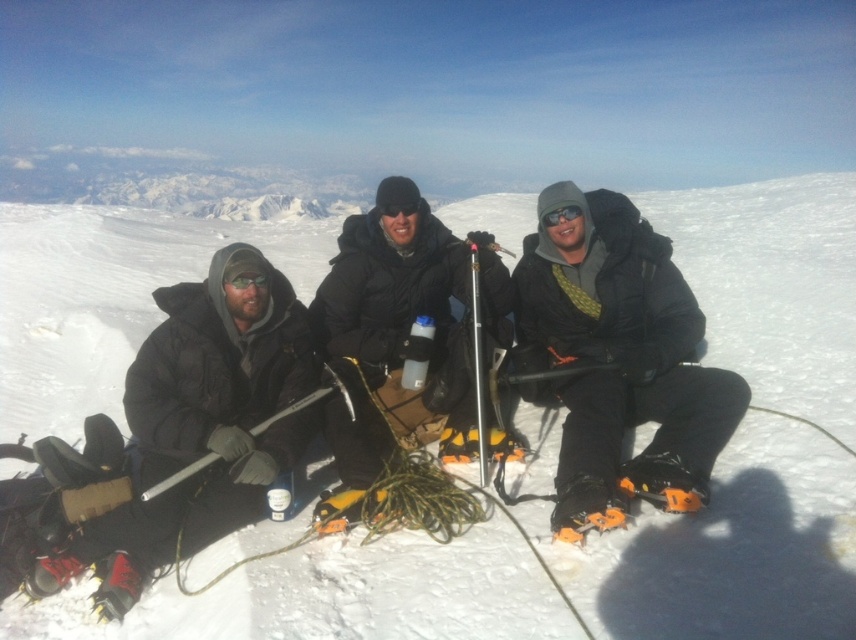
Question: Does white powder snow at center appear on the right side of matte black jacket at center?

Choices:
 (A) no
 (B) yes

Answer: (A)

Question: Is white powder snow at center positioned before matte black jacket at center?

Choices:
 (A) no
 (B) yes

Answer: (B)

Question: Does white powder snow at center appear on the right side of matte black jacket at center?

Choices:
 (A) no
 (B) yes

Answer: (A)

Question: Which point is farther to the camera?

Choices:
 (A) (705, 605)
 (B) (578, 417)

Answer: (B)

Question: Which point is closer to the camera taking this photo?

Choices:
 (A) (591, 528)
 (B) (845, 429)

Answer: (A)